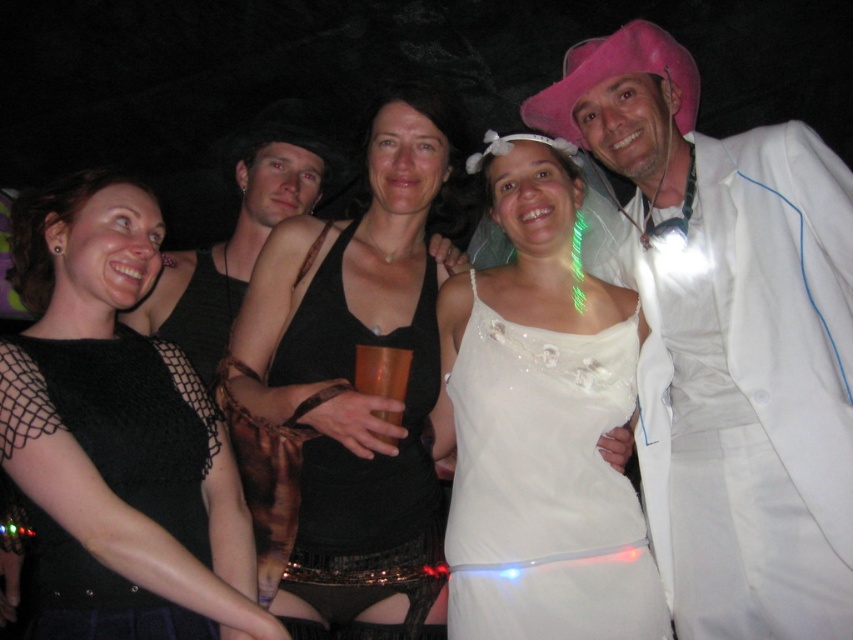
Is black mesh dress at left positioned before black leather hat at upper center?

Yes, it is in front of black leather hat at upper center.

This screenshot has width=853, height=640. In order to click on black mesh dress at left in this screenshot , I will do `click(117, 435)`.

Identify the location of black mesh dress at left. (117, 435).

Which of these two, black sequined dress at center or white satin dress at center, stands taller?

black sequined dress at center

Does black sequined dress at center have a smaller size compared to white satin dress at center?

No.

Identify the location of black sequined dress at center. (354, 388).

Can you confirm if black leather hat at upper center is wider than gold metallic cup at center?

Correct, the width of black leather hat at upper center exceeds that of gold metallic cup at center.

Identify the location of black leather hat at upper center. This screenshot has width=853, height=640. (241, 230).

Identify the location of black leather hat at upper center. (241, 230).

You are a GUI agent. You are given a task and a screenshot of the screen. Output one action in this format:
    pyautogui.click(x=<x>, y=<y>)
    Task: Click on the black leather hat at upper center
    The height and width of the screenshot is (640, 853).
    Given the screenshot: What is the action you would take?
    pyautogui.click(x=241, y=230)